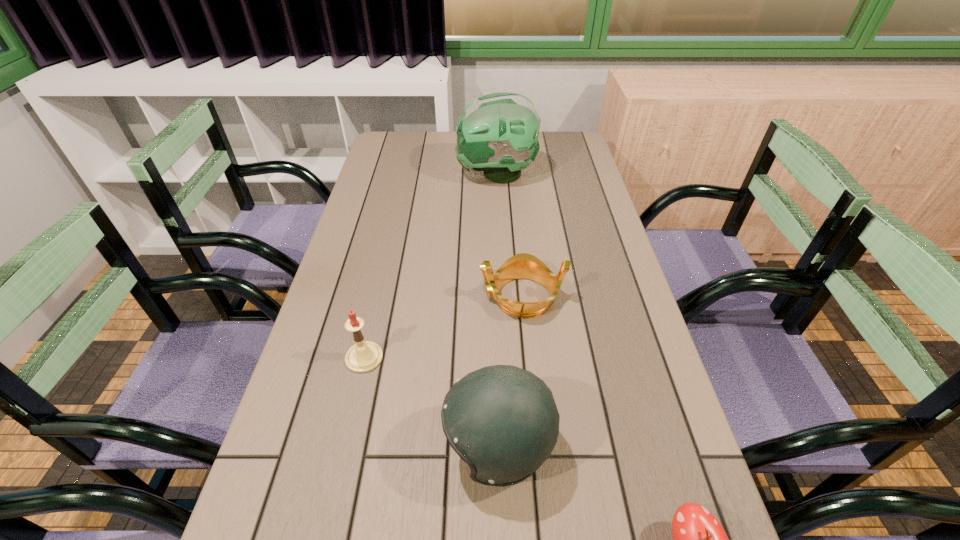
At what (x,y) coordinates should I click in order to perform the action: click on vacant space at the left edge. Please return your answer as a coordinate pair (x, y). The image size is (960, 540). Looking at the image, I should click on (388, 195).

At what (x,y) coordinates should I click in order to perform the action: click on free region at the right edge of the desktop. Please return your answer as a coordinate pair (x, y). Image resolution: width=960 pixels, height=540 pixels. Looking at the image, I should click on (580, 178).

In the image, there is a desktop. At what (x,y) coordinates should I click in order to perform the action: click on vacant region at the far left corner. Please return your answer as a coordinate pair (x, y). The width and height of the screenshot is (960, 540). Looking at the image, I should click on (417, 156).

Where is `vacant space at the far right corner`? The height and width of the screenshot is (540, 960). vacant space at the far right corner is located at coordinates (572, 131).

Identify the location of free space that is in between the third tallest object and the shorter football helmet. (432, 402).

Locate an element on the screen. The height and width of the screenshot is (540, 960). free space between the second tallest object and the farthest object is located at coordinates (497, 310).

Identify the location of empty space that is in between the leftmost object and the fourth nearest object. The height and width of the screenshot is (540, 960). coord(444,327).

Identify the location of vacant point located between the tallest object and the tiara. Image resolution: width=960 pixels, height=540 pixels. (509, 235).

What are the coordinates of `free space between the tallest object and the leftmost object` in the screenshot? It's located at (430, 266).

Identify the location of free space between the taller football helmet and the fourth farthest object. (497, 310).